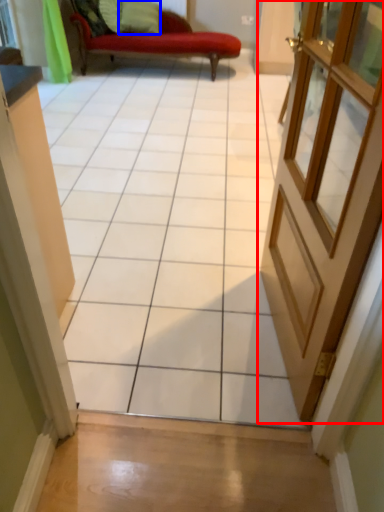
Question: Which object appears farthest to the camera in this image, door (highlighted by a red box) or pillow (highlighted by a blue box)?

Choices:
 (A) door
 (B) pillow

Answer: (B)